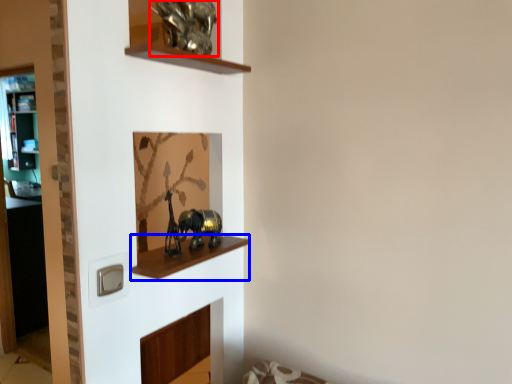
Question: Which object appears closest to the camera in this image, animal (highlighted by a red box) or cabinet (highlighted by a blue box)?

Choices:
 (A) animal
 (B) cabinet

Answer: (B)